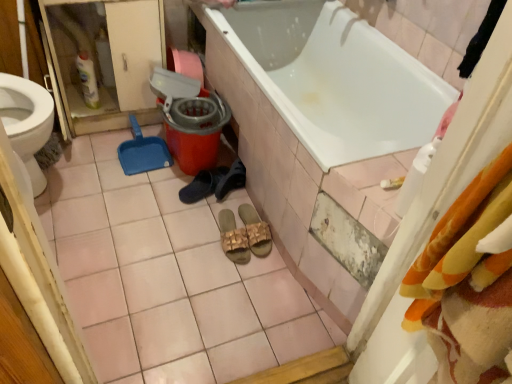
Describe the element at coordinates (231, 180) in the screenshot. I see `black suede shoes at center, positioned as the second footwear in right-to-left order` at that location.

What is the approximate width of matte white screen door at left?

matte white screen door at left is 35.79 centimeters in width.

What do you see at coordinates (256, 231) in the screenshot?
I see `beige woven sandals at center, acting as the 3th footwear starting from the left` at bounding box center [256, 231].

I want to click on black suede shoes at center, positioned as the second footwear in right-to-left order, so click(231, 180).

Considering the positions of objects beige woven sandals at center, acting as the 3th footwear starting from the left, and matte white screen door at left in the image provided, who is more to the right, beige woven sandals at center, acting as the 3th footwear starting from the left, or matte white screen door at left?

beige woven sandals at center, acting as the 3th footwear starting from the left, is more to the right.

Is beige woven sandals at center, the 1th footwear in the right-to-left sequence, wider or thinner than matte white screen door at left?

beige woven sandals at center, the 1th footwear in the right-to-left sequence, is thinner than matte white screen door at left.

Between point (248, 208) and point (74, 44), which one is positioned behind?

Point (74, 44)

Can you tell me how much beige woven sandals at center, acting as the 3th footwear starting from the left, and black rubber slipper at center, which appears as the first footwear when viewed from the left, differ in facing direction?

The facing directions of beige woven sandals at center, acting as the 3th footwear starting from the left, and black rubber slipper at center, which appears as the first footwear when viewed from the left, are 85.2 degrees apart.

Choose the correct answer: Is beige woven sandals at center, the 1th footwear in the right-to-left sequence, inside black rubber slipper at center, acting as the 3th footwear starting from the right, or outside it?

beige woven sandals at center, the 1th footwear in the right-to-left sequence, exists outside the volume of black rubber slipper at center, acting as the 3th footwear starting from the right.

Can you confirm if beige woven sandals at center, acting as the 3th footwear starting from the left, is positioned to the right of black rubber slipper at center, acting as the 3th footwear starting from the right?

Yes.

Considering the relative sizes of beige woven sandals at center, the 1th footwear in the right-to-left sequence, and black rubber slipper at center, which appears as the first footwear when viewed from the left, in the image provided, is beige woven sandals at center, the 1th footwear in the right-to-left sequence, shorter than black rubber slipper at center, which appears as the first footwear when viewed from the left,?

Incorrect, the height of beige woven sandals at center, the 1th footwear in the right-to-left sequence, does not fall short of that of black rubber slipper at center, which appears as the first footwear when viewed from the left.

Is matte white screen door at left taller than black rubber slipper at center, acting as the 3th footwear starting from the right?

Yes.

Based on their positions, is matte white screen door at left located to the left or right of black rubber slipper at center, acting as the 3th footwear starting from the right?

matte white screen door at left is positioned on black rubber slipper at center, acting as the 3th footwear starting from the right,'s left side.

Who is bigger, matte white screen door at left or black rubber slipper at center, acting as the 3th footwear starting from the right?

Bigger between the two is matte white screen door at left.

From a real-world perspective, is matte white screen door at left below black rubber slipper at center, acting as the 3th footwear starting from the right?

No, from a real-world perspective, matte white screen door at left is not beneath black rubber slipper at center, acting as the 3th footwear starting from the right.

Which object is further away from the camera taking this photo, matte white screen door at left or black suede shoes at center, positioned as the second footwear in right-to-left order?

black suede shoes at center, positioned as the second footwear in right-to-left order, is further away from the camera.

Locate an element on the screen. Image resolution: width=512 pixels, height=384 pixels. the 2nd footwear counting from the right side of the matte white screen door at left is located at coordinates (231, 180).

Considering the relative sizes of matte white screen door at left and black suede shoes at center, which ranks as the second footwear in left-to-right order, in the image provided, is matte white screen door at left smaller than black suede shoes at center, which ranks as the second footwear in left-to-right order,?

Actually, matte white screen door at left might be larger than black suede shoes at center, which ranks as the second footwear in left-to-right order.

Between point (59, 60) and point (245, 178), which one is positioned behind?

The point (59, 60) is more distant.

Which is in front, black suede shoes at center, positioned as the second footwear in right-to-left order, or white glossy bathtub at center?

Positioned in front is white glossy bathtub at center.

In the scene shown: From a real-world perspective, which is physically above, black suede shoes at center, positioned as the second footwear in right-to-left order, or white glossy bathtub at center?

white glossy bathtub at center.

Consider the image. Is black suede shoes at center, which ranks as the second footwear in left-to-right order, taller or shorter than white glossy bathtub at center?

black suede shoes at center, which ranks as the second footwear in left-to-right order, is shorter than white glossy bathtub at center.

Is black suede shoes at center, which ranks as the second footwear in left-to-right order, facing towards white glossy bathtub at center?

No, black suede shoes at center, which ranks as the second footwear in left-to-right order, is not facing towards white glossy bathtub at center.

From a real-world perspective, between white glossy bathtub at center and orange plastic mop bucket at center, who is vertically higher?

white glossy bathtub at center.

Considering the relative positions of white glossy bathtub at center and orange plastic mop bucket at center in the image provided, is white glossy bathtub at center to the left or to the right of orange plastic mop bucket at center?

white glossy bathtub at center is positioned on orange plastic mop bucket at center's right side.

Could you tell me if white glossy bathtub at center is facing orange plastic mop bucket at center?

Yes, white glossy bathtub at center is turned towards orange plastic mop bucket at center.

Are beige woven sandals at center, acting as the 3th footwear starting from the left, and white glossy bathtub at center far apart?

No, beige woven sandals at center, acting as the 3th footwear starting from the left, is not far from white glossy bathtub at center.

From the image's perspective, who appears lower, beige woven sandals at center, acting as the 3th footwear starting from the left, or white glossy bathtub at center?

beige woven sandals at center, acting as the 3th footwear starting from the left.

Does beige woven sandals at center, acting as the 3th footwear starting from the left, appear on the right side of white glossy bathtub at center?

No.

The width and height of the screenshot is (512, 384). There is a beige woven sandals at center, acting as the 3th footwear starting from the left. Identify the location of screen door above it (from a real-world perspective). (106, 58).

You are a GUI agent. You are given a task and a screenshot of the screen. Output one action in this format:
    pyautogui.click(x=<x>, y=<y>)
    Task: Click on the 1st footwear behind the beige woven sandals at center, acting as the 3th footwear starting from the left
    This screenshot has height=384, width=512.
    Given the screenshot: What is the action you would take?
    pyautogui.click(x=202, y=185)

Looking at the image, which one is located closer to beige woven sandals at center, the 1th footwear in the right-to-left sequence, matte white screen door at left or black suede shoes at center, which ranks as the second footwear in left-to-right order?

black suede shoes at center, which ranks as the second footwear in left-to-right order, is positioned closer to the anchor beige woven sandals at center, the 1th footwear in the right-to-left sequence.

Looking at this image, based on their spatial positions, is white glossy bathtub at center or matte white screen door at left further from beige woven sandals at center, acting as the 3th footwear starting from the left?

matte white screen door at left is positioned further to the anchor beige woven sandals at center, acting as the 3th footwear starting from the left.

Considering their positions, is beige woven sandals at center, acting as the 3th footwear starting from the left, positioned further to white glossy bathtub at center than orange plastic mop bucket at center?

beige woven sandals at center, acting as the 3th footwear starting from the left, is further to white glossy bathtub at center.

When comparing their distances from beige woven sandals at center, acting as the 3th footwear starting from the left, does black suede shoes at center, which ranks as the second footwear in left-to-right order, or white glossy bathtub at center seem closer?

black suede shoes at center, which ranks as the second footwear in left-to-right order, is closer to beige woven sandals at center, acting as the 3th footwear starting from the left.

When comparing their distances from white glossy bathtub at center, does orange plastic mop bucket at center or matte white screen door at left seem closer?

Among the two, orange plastic mop bucket at center is located nearer to white glossy bathtub at center.

Considering their positions, is beige woven sandals at center, the 1th footwear in the right-to-left sequence, positioned closer to matte white screen door at left than black suede shoes at center, positioned as the second footwear in right-to-left order?

black suede shoes at center, positioned as the second footwear in right-to-left order, is positioned closer to the anchor matte white screen door at left.

From the image, which object appears to be farther from black rubber slipper at center, acting as the 3th footwear starting from the right, black suede shoes at center, which ranks as the second footwear in left-to-right order, or orange plastic mop bucket at center?

Among the two, orange plastic mop bucket at center is located further to black rubber slipper at center, acting as the 3th footwear starting from the right.

Estimate the real-world distances between objects in this image. Which object is closer to orange plastic mop bucket at center, white glossy bathtub at center or black rubber slipper at center, acting as the 3th footwear starting from the right?

The object closer to orange plastic mop bucket at center is black rubber slipper at center, acting as the 3th footwear starting from the right.

What are the coordinates of `footwear positioned between white glossy bathtub at center and black rubber slipper at center, which appears as the first footwear when viewed from the left, from near to far` in the screenshot? It's located at (256, 231).

The height and width of the screenshot is (384, 512). In order to click on footwear between orange plastic mop bucket at center and black rubber slipper at center, acting as the 3th footwear starting from the right, from top to bottom in this screenshot , I will do `click(231, 180)`.

This screenshot has height=384, width=512. What are the coordinates of `potty between matte white screen door at left and black suede shoes at center, which ranks as the second footwear in left-to-right order, vertically` in the screenshot? It's located at (196, 131).

Where is `potty between white glossy bathtub at center and black suede shoes at center, positioned as the second footwear in right-to-left order, from front to back`? The height and width of the screenshot is (384, 512). potty between white glossy bathtub at center and black suede shoes at center, positioned as the second footwear in right-to-left order, from front to back is located at coordinates (196, 131).